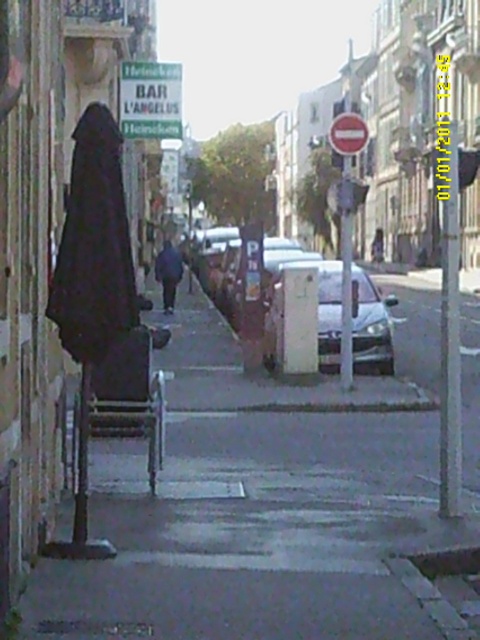
Is dark gray concrete sidewalk at left bigger than dark gray coat at center?

Indeed, dark gray concrete sidewalk at left has a larger size compared to dark gray coat at center.

Describe the element at coordinates (265, 512) in the screenshot. The height and width of the screenshot is (640, 480). I see `dark gray concrete sidewalk at left` at that location.

Where is `dark gray concrete sidewalk at left`? dark gray concrete sidewalk at left is located at coordinates (265, 512).

Does black matte coat at left appear over dark gray coat at center?

Incorrect, black matte coat at left is not positioned above dark gray coat at center.

Does black matte coat at left have a lesser height compared to dark gray coat at center?

Yes.

Between point (54, 316) and point (169, 284), which one is positioned behind?

The point (169, 284) is behind.

At what (x,y) coordinates should I click in order to perform the action: click on black matte coat at left. Please return your answer as a coordinate pair (x, y). This screenshot has height=640, width=480. Looking at the image, I should click on (94, 244).

Is dark gray concrete sidewalk at left further to camera compared to white glossy car at center?

No, it is in front of white glossy car at center.

Who is positioned more to the left, dark gray concrete sidewalk at left or white glossy car at center?

Positioned to the left is dark gray concrete sidewalk at left.

Find the location of `dark gray concrete sidewalk at left`. dark gray concrete sidewalk at left is located at coordinates (265, 512).